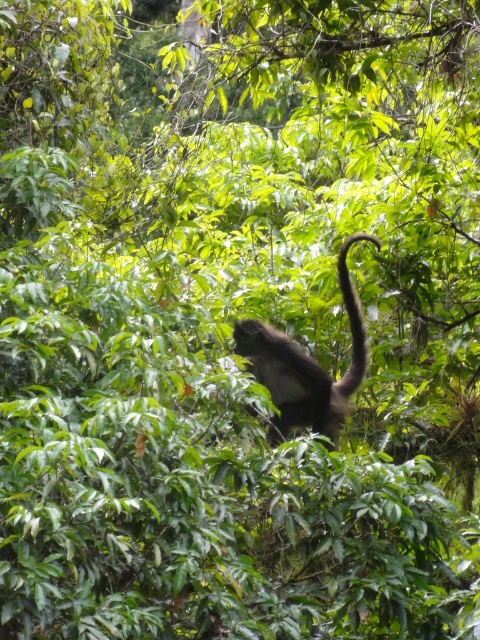
Consider the image. Can you confirm if brown furry monkey at center is taller than brown fuzzy tail at upper center?

Correct, brown furry monkey at center is much taller as brown fuzzy tail at upper center.

Who is positioned more to the right, brown furry monkey at center or brown fuzzy tail at upper center?

From the viewer's perspective, brown fuzzy tail at upper center appears more on the right side.

Is point (360, 236) farther from viewer compared to point (358, 360)?

No.

At what (x,y) coordinates should I click in order to perform the action: click on brown furry monkey at center. Please return your answer as a coordinate pair (x, y). This screenshot has height=640, width=480. Looking at the image, I should click on (305, 365).